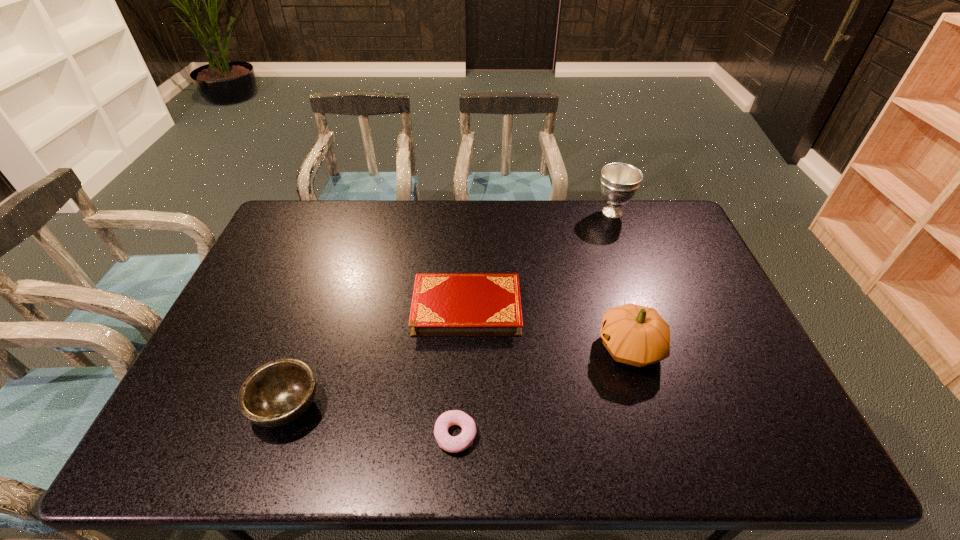
Identify the location of free region located on the back of the third shortest object. (326, 293).

This screenshot has height=540, width=960. What are the coordinates of `vacant space located on the cover of the hardback book` in the screenshot? It's located at (601, 308).

I want to click on free space located on the left of the doughnut, so click(x=267, y=435).

Identify the location of object at the far edge. The height and width of the screenshot is (540, 960). (619, 182).

Locate an element on the screen. The height and width of the screenshot is (540, 960). bowl that is at the near edge is located at coordinates 277,393.

Locate an element on the screen. This screenshot has height=540, width=960. doughnut present at the near edge is located at coordinates (459, 443).

Find the location of `free region at the far edge`. free region at the far edge is located at coordinates (555, 225).

Find the location of a particular element. The width and height of the screenshot is (960, 540). vacant space at the near edge is located at coordinates (716, 438).

In order to click on free space at the right edge of the desktop in this screenshot , I will do `click(685, 244)`.

This screenshot has height=540, width=960. In order to click on free point between the shortest object and the leftmost object in this screenshot , I will do (372, 420).